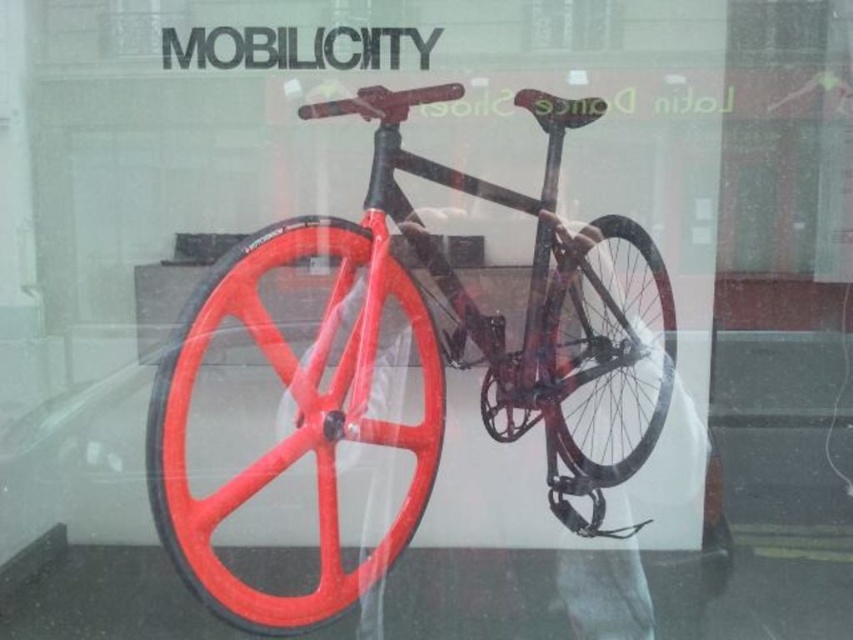
You are a customer standing outside the shop window. You see the shiny red rim at center represented by point (x=294, y=419). Can you tell me the coordinates of the shiny red rim at center?

The coordinates of the shiny red rim at center are point (x=294, y=419).